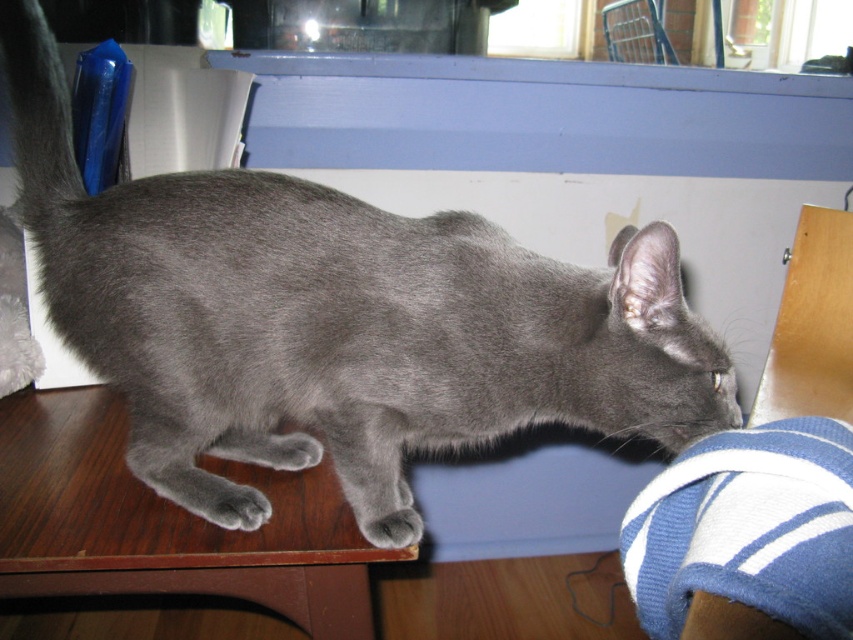
Who is lower down, wooden table at lower left or gray fur paw at lower left?

Positioned lower is wooden table at lower left.

Can you confirm if wooden table at lower left is wider than gray fur paw at lower left?

Correct, the width of wooden table at lower left exceeds that of gray fur paw at lower left.

Does point (260, 561) come in front of point (206, 486)?

Yes, it is in front of point (206, 486).

Identify the location of wooden table at lower left. The height and width of the screenshot is (640, 853). (167, 524).

Based on the photo, between silvery-gray fur tail at left and gray fur paw at lower center, which one has less height?

gray fur paw at lower center is shorter.

Does point (13, 120) come behind point (361, 513)?

Yes.

At what (x,y) coordinates should I click in order to perform the action: click on silvery-gray fur tail at left. Please return your answer as a coordinate pair (x, y). This screenshot has height=640, width=853. Looking at the image, I should click on (38, 116).

Is wooden table at lower left bigger than silvery-gray fur tail at left?

Yes.

Is wooden table at lower left closer to the viewer compared to silvery-gray fur tail at left?

Yes.

Between point (190, 515) and point (61, 173), which one is positioned in front?

Point (190, 515) is more forward.

This screenshot has width=853, height=640. Find the location of `wooden table at lower left`. wooden table at lower left is located at coordinates (167, 524).